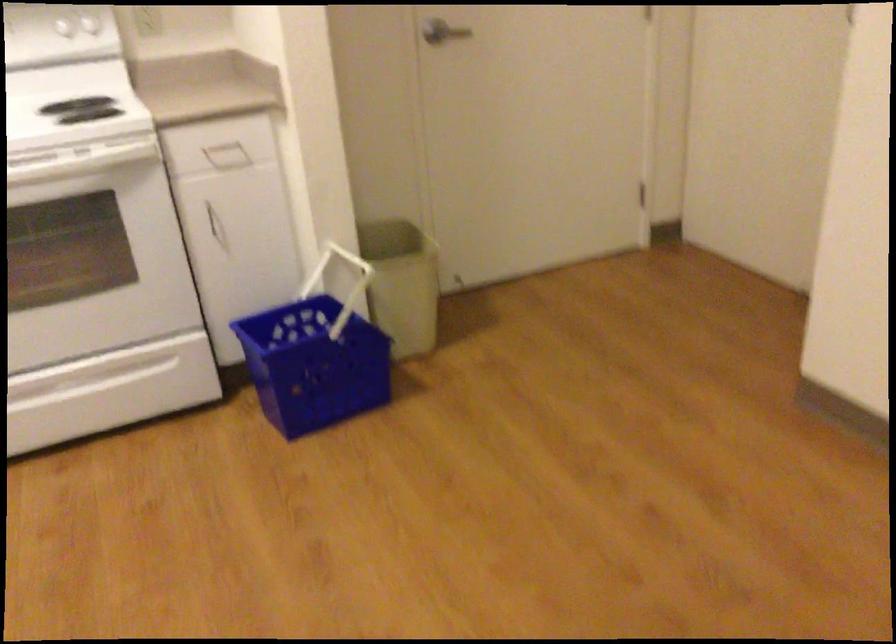
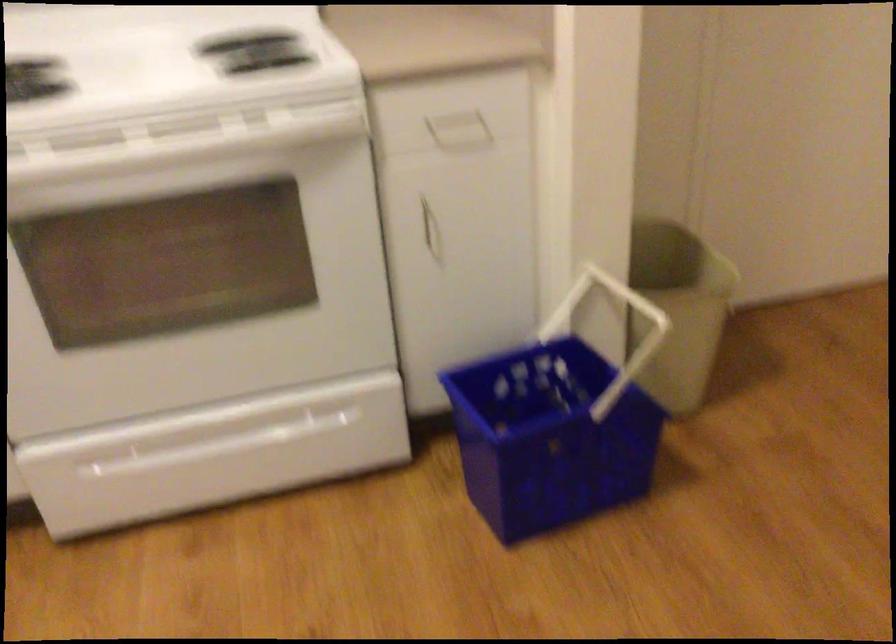
Find the pixel in the second image that matches pixel 401 270 in the first image.

(678, 308)